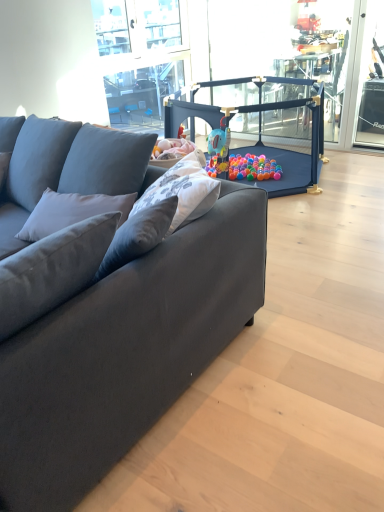
The height and width of the screenshot is (512, 384). Find the location of `suede dark gray couch at left`. suede dark gray couch at left is located at coordinates 105,310.

This screenshot has width=384, height=512. I want to click on matte blue playpen at center, so click(x=259, y=130).

Which of these two, suede dark gray couch at left or matte blue playpen at center, stands taller?

suede dark gray couch at left.

Is suede dark gray couch at left far away from matte blue playpen at center?

Yes, suede dark gray couch at left and matte blue playpen at center are located far from each other.

From the image's perspective, which is above, suede dark gray couch at left or matte blue playpen at center?

matte blue playpen at center, from the image's perspective.

How different are the orientations of suede dark gray couch at left and matte blue playpen at center in degrees?

92.7 degrees.

Who is more distant, matte blue playpen at center or clear glass window screen at right?

Positioned behind is clear glass window screen at right.

Would you consider matte blue playpen at center to be distant from clear glass window screen at right?

No, matte blue playpen at center is not far from clear glass window screen at right.

Considering the points (191, 119) and (378, 112), which point is behind, point (191, 119) or point (378, 112)?

The point (378, 112) is more distant.

This screenshot has width=384, height=512. I want to click on window screen on the right of matte blue playpen at center, so tap(371, 80).

Between matte blue playpen at center and suede dark gray couch at left, which one has larger size?

suede dark gray couch at left.

Is matte blue playpen at center to the right of suede dark gray couch at left from the viewer's perspective?

Correct, you'll find matte blue playpen at center to the right of suede dark gray couch at left.

Between matte blue playpen at center and suede dark gray couch at left, which one has larger width?

matte blue playpen at center.

Is matte blue playpen at center turned away from suede dark gray couch at left?

No, matte blue playpen at center's orientation is not away from suede dark gray couch at left.

Considering the relative sizes of clear glass window screen at right and matte blue playpen at center in the image provided, is clear glass window screen at right wider than matte blue playpen at center?

No, clear glass window screen at right is not wider than matte blue playpen at center.

From the image's perspective, which is above, clear glass window screen at right or matte blue playpen at center?

From the image's view, clear glass window screen at right is above.

This screenshot has width=384, height=512. In order to click on baby carriage in front of the clear glass window screen at right in this screenshot , I will do `click(259, 130)`.

From a real-world perspective, who is located higher, clear glass window screen at right or matte blue playpen at center?

clear glass window screen at right.

From a real-world perspective, which object stands above the other?

clear glass window screen at right is physically above.

Between suede dark gray couch at left and clear glass window screen at right, which one is positioned in front?

suede dark gray couch at left is in front.

Is suede dark gray couch at left oriented away from clear glass window screen at right?

Absolutely, suede dark gray couch at left is directed away from clear glass window screen at right.

Which of these two, suede dark gray couch at left or clear glass window screen at right, is wider?

suede dark gray couch at left is wider.

From a real-world perspective, who is located lower, clear glass window screen at right or suede dark gray couch at left?

suede dark gray couch at left.

Is suede dark gray couch at left located within clear glass window screen at right?

No, clear glass window screen at right does not contain suede dark gray couch at left.

Which is closer, (382,108) or (192,315)?

Point (382,108).

At what (x,y) coordinates should I click in order to perform the action: click on baby carriage above the suede dark gray couch at left (from the image's perspective). Please return your answer as a coordinate pair (x, y). This screenshot has width=384, height=512. Looking at the image, I should click on (259, 130).

Locate an element on the screen. Image resolution: width=384 pixels, height=512 pixels. baby carriage below the clear glass window screen at right (from the image's perspective) is located at coordinates click(259, 130).

When comparing their distances from clear glass window screen at right, does suede dark gray couch at left or matte blue playpen at center seem closer?

matte blue playpen at center is closer to clear glass window screen at right.

Based on their spatial positions, is matte blue playpen at center or clear glass window screen at right closer to suede dark gray couch at left?

matte blue playpen at center is positioned closer to the anchor suede dark gray couch at left.

From the image, which object appears to be nearer to suede dark gray couch at left, clear glass window screen at right or matte blue playpen at center?

Based on the image, matte blue playpen at center appears to be nearer to suede dark gray couch at left.

From the image, which object appears to be nearer to clear glass window screen at right, matte blue playpen at center or suede dark gray couch at left?

Based on the image, matte blue playpen at center appears to be nearer to clear glass window screen at right.

Based on their spatial positions, is clear glass window screen at right or suede dark gray couch at left closer to matte blue playpen at center?

Among the two, clear glass window screen at right is located nearer to matte blue playpen at center.

Which object lies further to the anchor point matte blue playpen at center, suede dark gray couch at left or clear glass window screen at right?

suede dark gray couch at left is further to matte blue playpen at center.

Locate an element on the screen. Image resolution: width=384 pixels, height=512 pixels. baby carriage between suede dark gray couch at left and clear glass window screen at right along the z-axis is located at coordinates (259, 130).